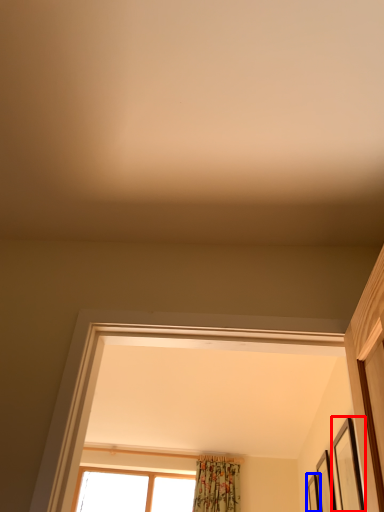
Question: Among these objects, which one is farthest to the camera, picture frame (highlighted by a red box) or picture frame (highlighted by a blue box)?

Choices:
 (A) picture frame
 (B) picture frame

Answer: (B)